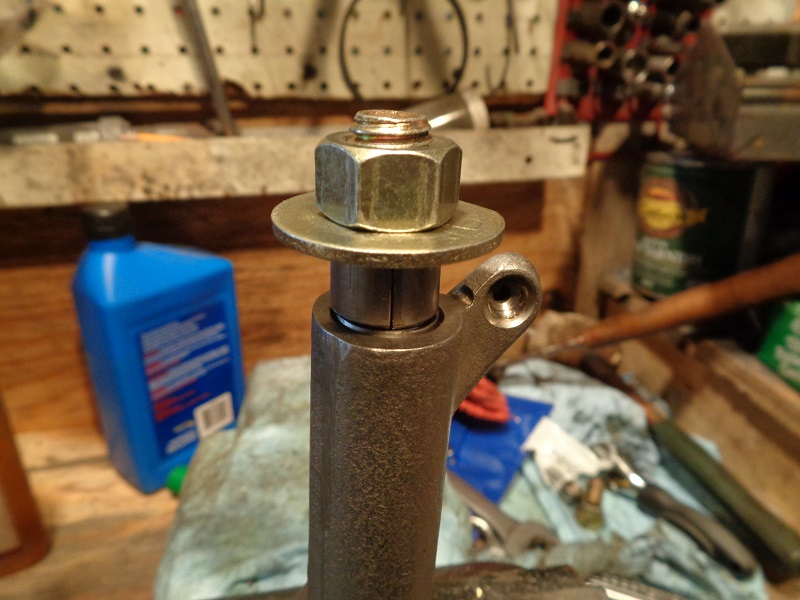
I want to click on pegboard, so click(128, 35).